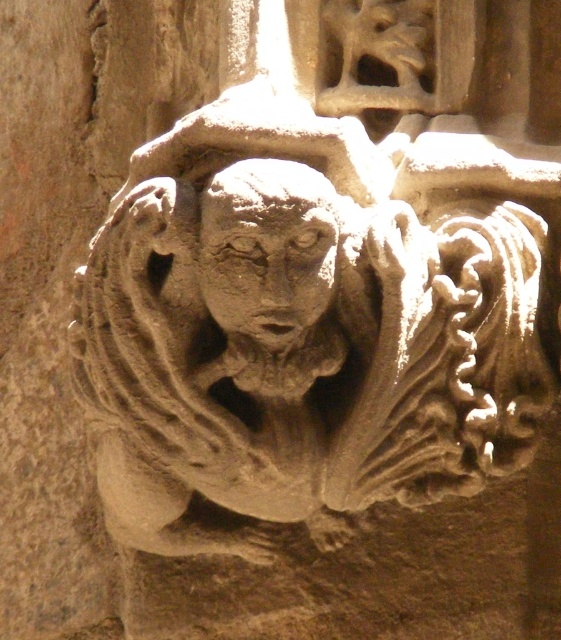
Does point (279, 202) lie behind point (305, 244)?

No.

Does point (420, 241) come closer to viewer compared to point (275, 266)?

No.

Where is `gray stone lion at center`? The height and width of the screenshot is (640, 561). gray stone lion at center is located at coordinates (301, 356).